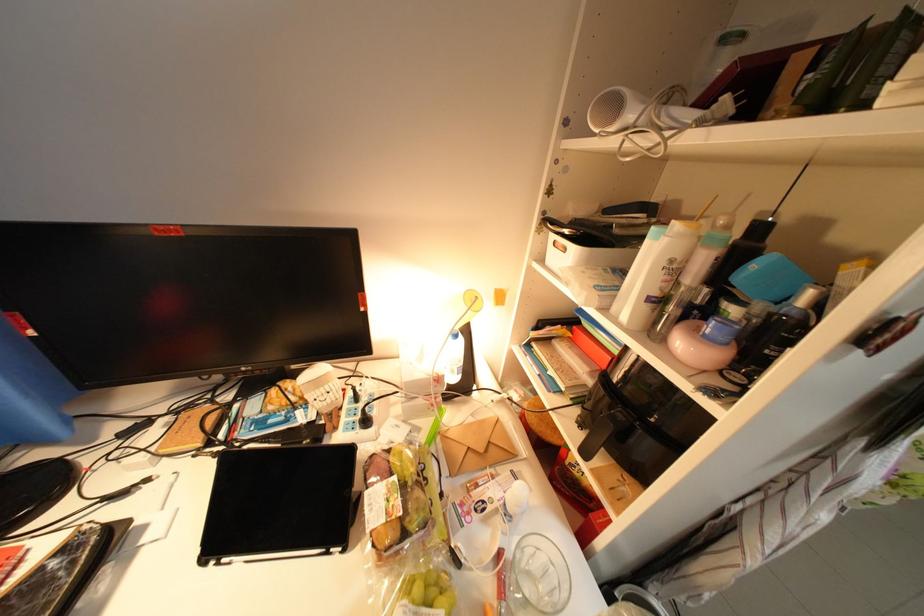
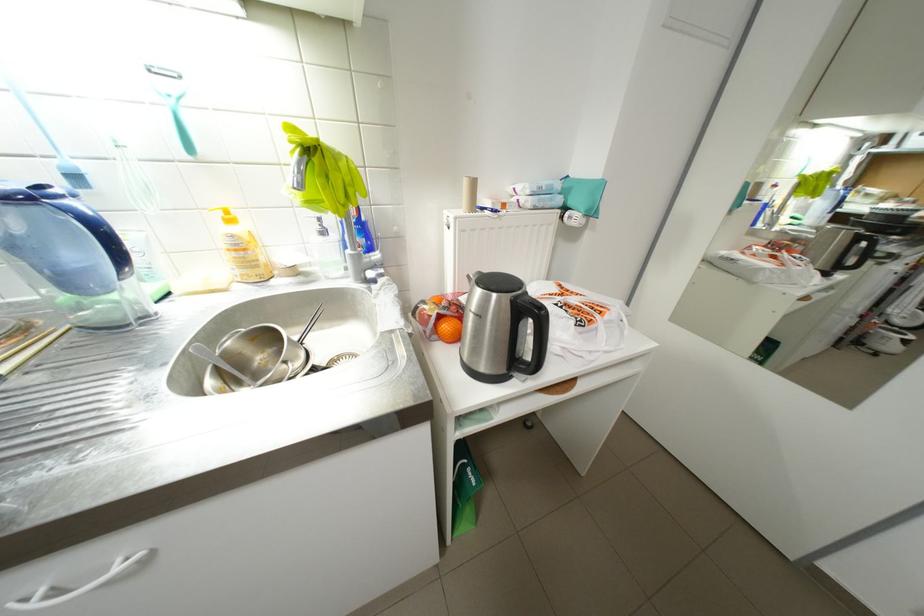
Question: In a continuous first-person perspective shot, in which direction is the camera moving?

Choices:
 (A) Left
 (B) Right
 (C) Forward
 (D) Backward

Answer: (B)